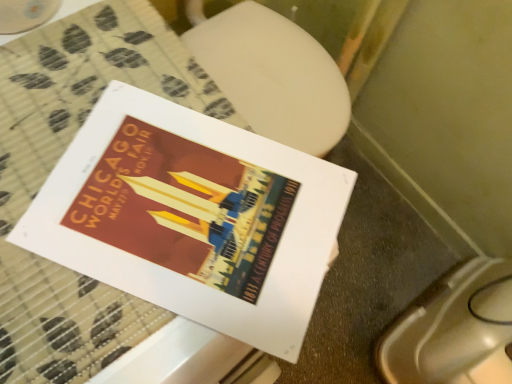
Locate an element on the screen. This screenshot has width=512, height=384. white glossy toilet bowl at lower right is located at coordinates (454, 329).

The image size is (512, 384). What do you see at coordinates (454, 329) in the screenshot?
I see `white glossy toilet bowl at lower right` at bounding box center [454, 329].

Find the location of a particular element. Image resolution: width=512 pixels, height=384 pixels. matte paper poster at center is located at coordinates (192, 217).

What is the approximate height of matte paper poster at center?

The height of matte paper poster at center is 0.66 inches.

Measure the distance between point (197, 288) and camera.

15.91 inches.

Describe the element at coordinates (192, 217) in the screenshot. I see `matte paper poster at center` at that location.

Locate an element on the screen. The width and height of the screenshot is (512, 384). white glossy toilet bowl at lower right is located at coordinates (454, 329).

Is matte paper poster at center at the left side of white glossy toilet bowl at lower right?

Indeed, matte paper poster at center is positioned on the left side of white glossy toilet bowl at lower right.

Which object is closer to the camera taking this photo, matte paper poster at center or white glossy toilet bowl at lower right?

matte paper poster at center is in front.

Is point (67, 221) more distant than point (418, 370)?

No, (67, 221) is in front of (418, 370).

From the image's perspective, is matte paper poster at center located above or below white glossy toilet bowl at lower right?

matte paper poster at center is above white glossy toilet bowl at lower right.

From a real-world perspective, is matte paper poster at center physically located above or below white glossy toilet bowl at lower right?

matte paper poster at center is situated higher than white glossy toilet bowl at lower right in the real world.

Between matte paper poster at center and white glossy toilet bowl at lower right, which one has larger width?

With larger width is white glossy toilet bowl at lower right.

Considering the relative sizes of matte paper poster at center and white glossy toilet bowl at lower right in the image provided, is matte paper poster at center taller than white glossy toilet bowl at lower right?

No, matte paper poster at center is not taller than white glossy toilet bowl at lower right.

From the picture: Can you confirm if matte paper poster at center is smaller than white glossy toilet bowl at lower right?

Indeed, matte paper poster at center has a smaller size compared to white glossy toilet bowl at lower right.

Is white glossy toilet bowl at lower right completely or partially inside matte paper poster at center?

No, white glossy toilet bowl at lower right is not surrounded by matte paper poster at center.

Are matte paper poster at center and white glossy toilet bowl at lower right located far from each other?

Actually, matte paper poster at center and white glossy toilet bowl at lower right are a little close together.

Is matte paper poster at center positioned with its back to white glossy toilet bowl at lower right?

That's not correct — matte paper poster at center is not looking away from white glossy toilet bowl at lower right.

I want to click on toilet bowl below the matte paper poster at center (from a real-world perspective), so click(454, 329).

Is white glossy toilet bowl at lower right at the left side of matte paper poster at center?

Incorrect, white glossy toilet bowl at lower right is not on the left side of matte paper poster at center.

In the scene shown: Which is behind, white glossy toilet bowl at lower right or matte paper poster at center?

white glossy toilet bowl at lower right is behind.

Which point is more distant from viewer, (435, 377) or (291, 214)?

Positioned behind is point (435, 377).

From the image's perspective, between white glossy toilet bowl at lower right and matte paper poster at center, which one is located above?

matte paper poster at center is shown above in the image.

From a real-world perspective, between white glossy toilet bowl at lower right and matte paper poster at center, who is vertically higher?

From a 3D spatial view, matte paper poster at center is above.

Between white glossy toilet bowl at lower right and matte paper poster at center, which one has smaller width?

matte paper poster at center is thinner.

Considering the sizes of white glossy toilet bowl at lower right and matte paper poster at center in the image, is white glossy toilet bowl at lower right taller or shorter than matte paper poster at center?

Clearly, white glossy toilet bowl at lower right is taller compared to matte paper poster at center.

Which of these two, white glossy toilet bowl at lower right or matte paper poster at center, is bigger?

Bigger between the two is white glossy toilet bowl at lower right.

Is matte paper poster at center located within white glossy toilet bowl at lower right?

Actually, matte paper poster at center is outside white glossy toilet bowl at lower right.

Is white glossy toilet bowl at lower right next to matte paper poster at center and touching it?

No, white glossy toilet bowl at lower right is not making contact with matte paper poster at center.

Could you tell me if white glossy toilet bowl at lower right is turned towards matte paper poster at center?

No, white glossy toilet bowl at lower right does not turn towards matte paper poster at center.

How many degrees apart are the facing directions of white glossy toilet bowl at lower right and matte paper poster at center?

They differ by 110 degrees in their facing directions.

Image resolution: width=512 pixels, height=384 pixels. What are the coordinates of `book that appears on the left of white glossy toilet bowl at lower right` in the screenshot? It's located at (192, 217).

What are the coordinates of `toilet bowl beneath the matte paper poster at center (from a real-world perspective)` in the screenshot? It's located at (454, 329).

Locate an element on the screen. Image resolution: width=512 pixels, height=384 pixels. toilet bowl that appears behind the matte paper poster at center is located at coordinates pos(454,329).